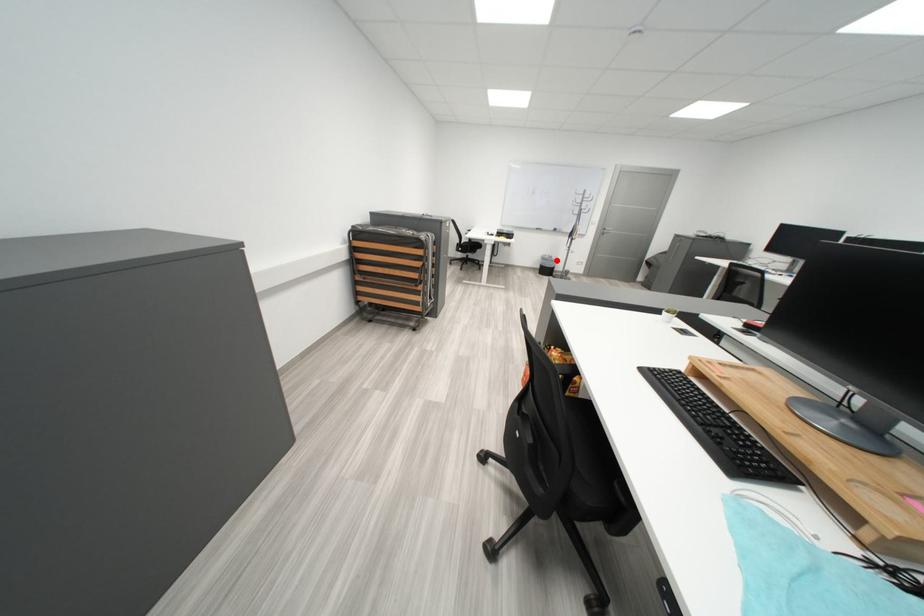
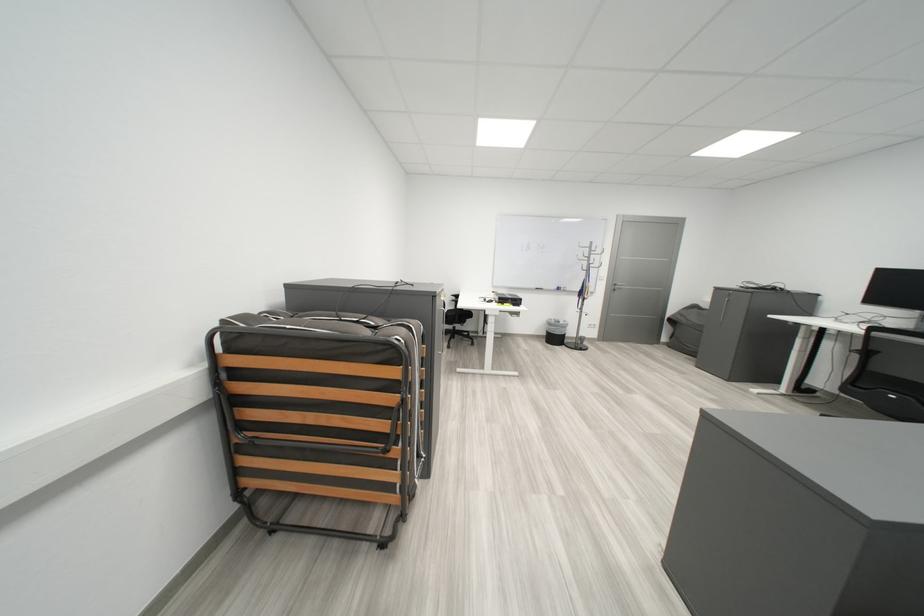
Question: I am providing you with two images of the same scene from different viewpoints. Given a red point in image1, look at the same physical point in image2. Is it:

Choices:
 (A) Closer to the viewpoint
 (B) Farther from the viewpoint

Answer: (B)